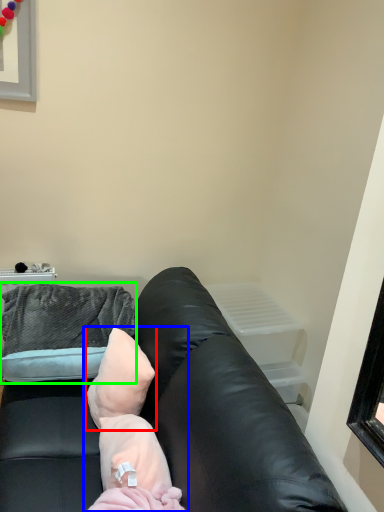
Question: Estimate the real-world distances between objects in this image. Which object is closer to pillow (highlighted by a red box), newborn (highlighted by a blue box) or throw pillow (highlighted by a green box)?

Choices:
 (A) newborn
 (B) throw pillow

Answer: (A)